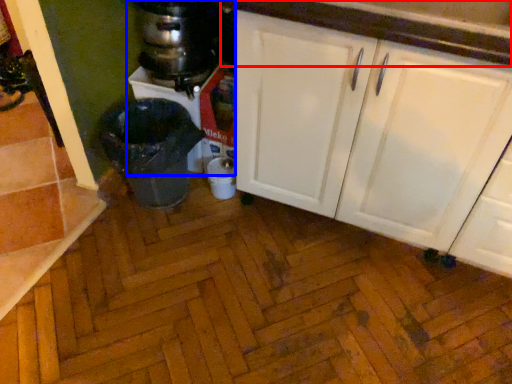
Question: Among these objects, which one is farthest to the camera, countertop (highlighted by a red box) or blender (highlighted by a blue box)?

Choices:
 (A) countertop
 (B) blender

Answer: (B)